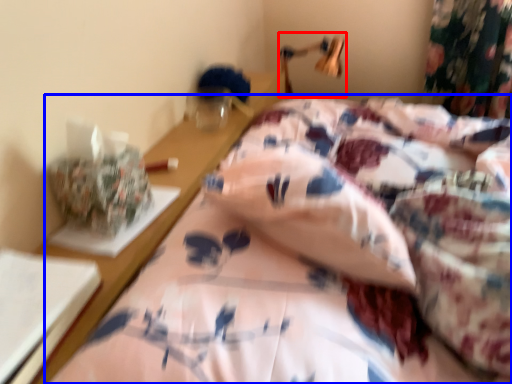
Question: Which point is further to the camera, table lamp (highlighted by a red box) or bed (highlighted by a blue box)?

Choices:
 (A) table lamp
 (B) bed

Answer: (A)